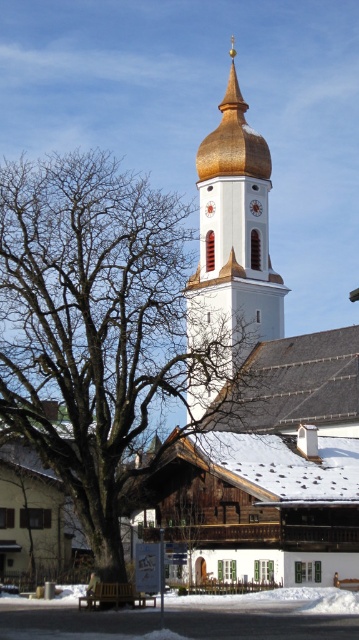
The width and height of the screenshot is (359, 640). Describe the element at coordinates (92, 324) in the screenshot. I see `bare wood tree at left` at that location.

This screenshot has width=359, height=640. Describe the element at coordinates (92, 324) in the screenshot. I see `bare wood tree at left` at that location.

Find the location of a particular element. bare wood tree at left is located at coordinates (92, 324).